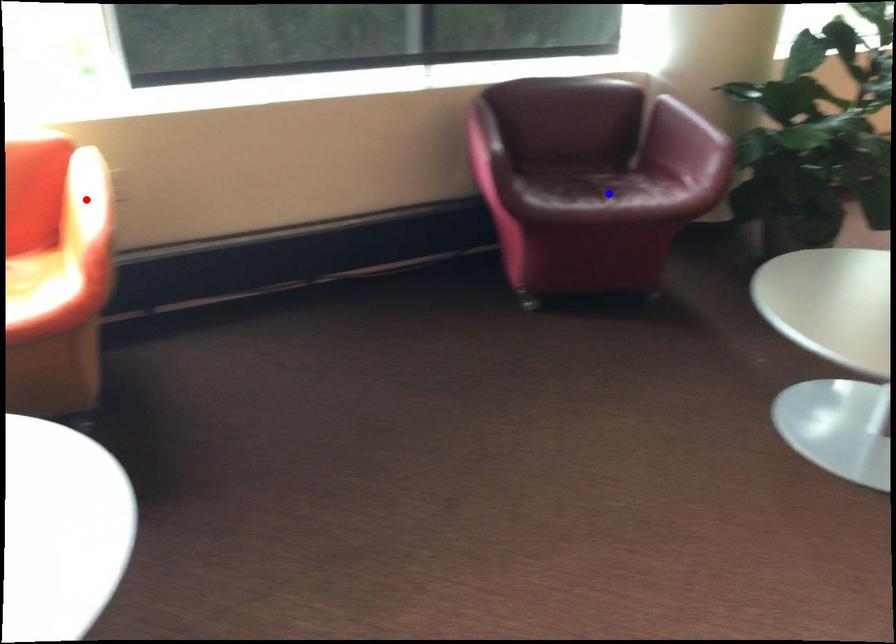
Question: Which of the two points in the image is closer to the camera?

Choices:
 (A) Blue point is closer.
 (B) Red point is closer.

Answer: (B)